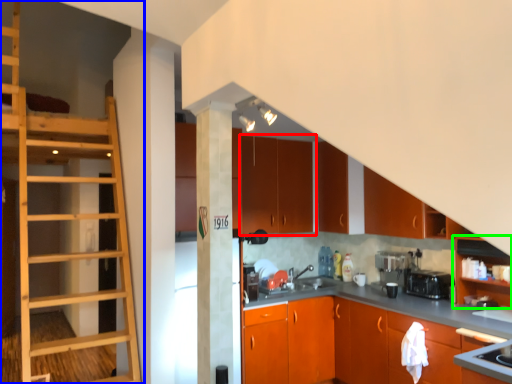
Question: Considering the real-world distances, which object is farthest from cabinetry (highlighted by a red box)? ladder (highlighted by a blue box) or cabinetry (highlighted by a green box)?

Choices:
 (A) ladder
 (B) cabinetry

Answer: (B)